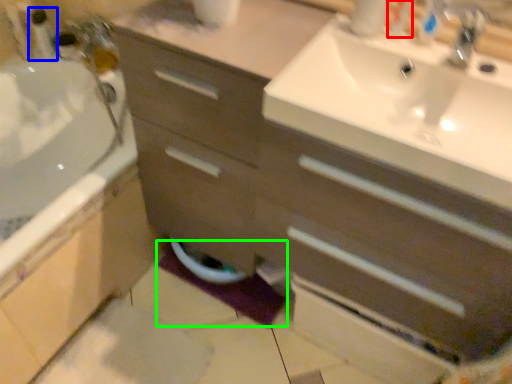
Question: Based on their relative distances, which object is farther from toiletry (highlighted by a red box)? Choose from toiletry (highlighted by a blue box) and bath mat (highlighted by a green box).

Choices:
 (A) toiletry
 (B) bath mat

Answer: (A)